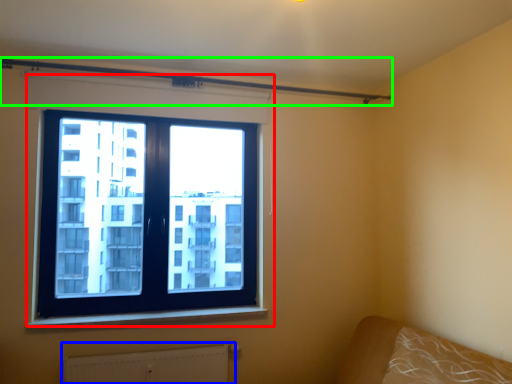
Question: Which is farther away from window (highlighted by a red box)? radiator (highlighted by a blue box) or beam (highlighted by a green box)?

Choices:
 (A) radiator
 (B) beam

Answer: (A)